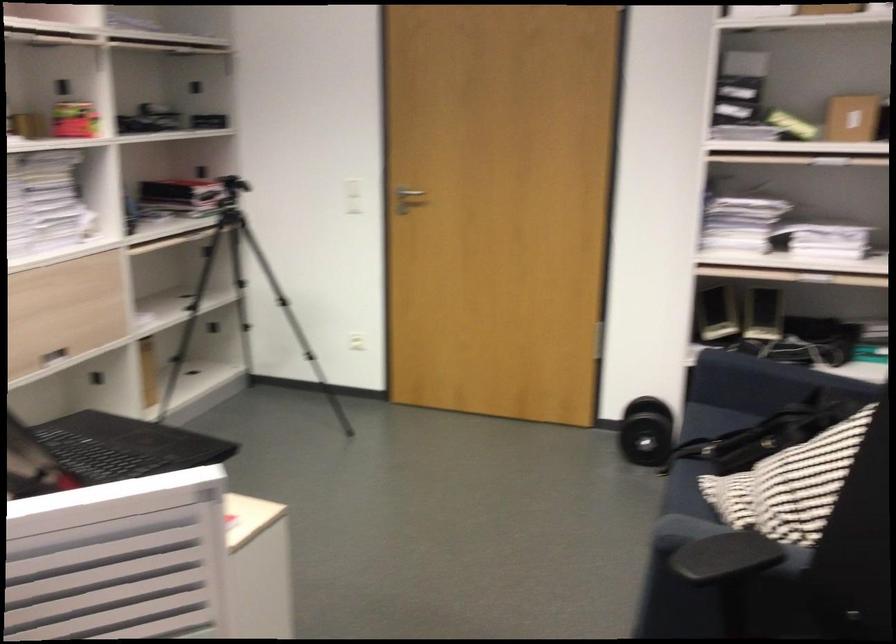
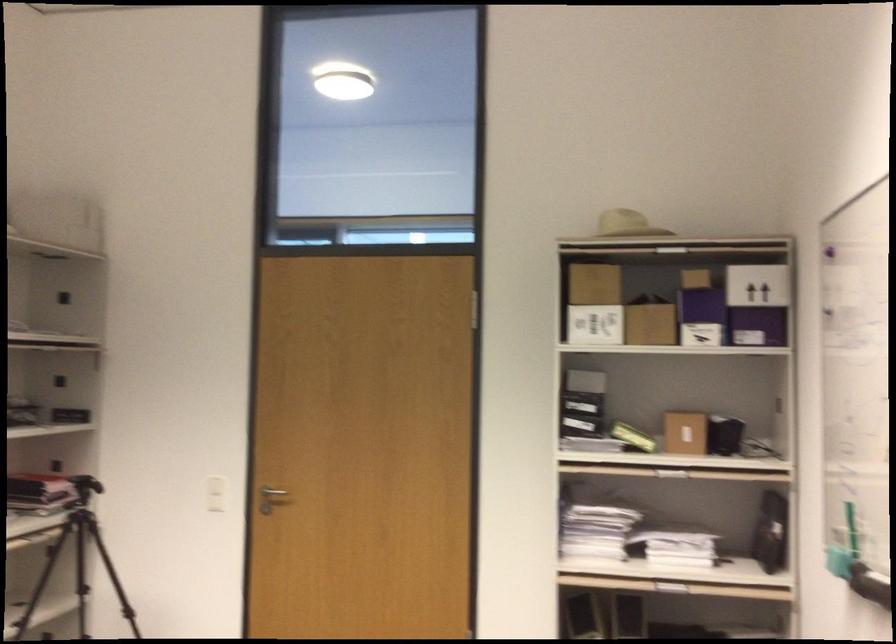
The point at (x=791, y=122) is marked in the first image. Where is the corresponding point in the second image?

(633, 437)